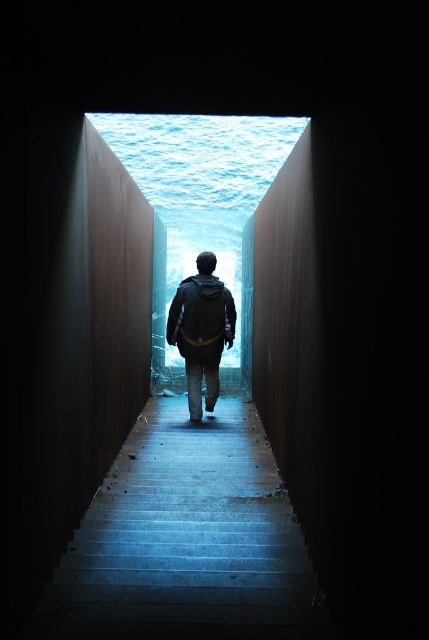
You are standing at the bottom of the concrete stairs at center. You want to reach the blue glass water at center. Which direction should you move in?

You should move forward towards the blue glass water at center because the concrete stairs at center is in front of it, so moving forward along the stairs will lead you directly to the water.

You are standing at the bottom of the concrete stairs at center. You want to reach the blue glass water at center. Which direction should you move?

You should move upward because the concrete stairs at center is below the blue glass water at center.